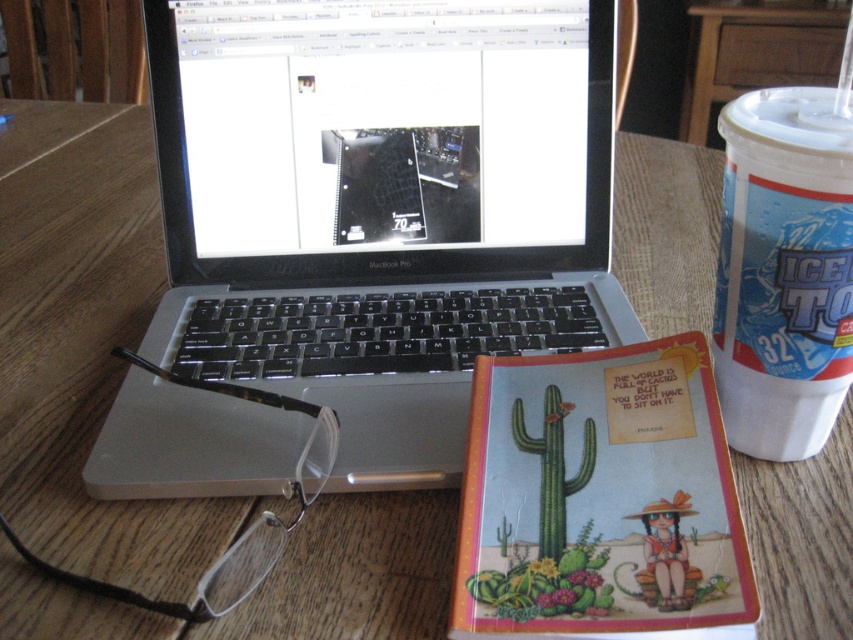
You are a delivery robot with a 35 cm arm. You need to pick up the white paper cup at right from the workspace. Can your arm reach it?

The white paper cup at right is 34.92 centimeters away from the camera, so yes, the robot can reach it with its 35 cm arm since the distance is slightly less than the arm length.

You are setting up a small plant on the wooden table. You have a green matte cactus at center and a white paper cup at right. Which object is wider?

The white paper cup at right is wider than the green matte cactus at center.